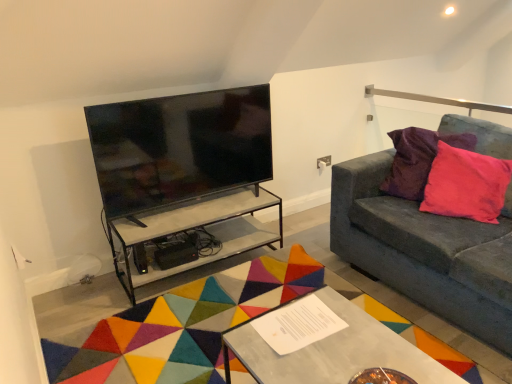
The width and height of the screenshot is (512, 384). I want to click on vacant space underneath black glossy tv at upper left (from a real-world perspective), so click(186, 202).